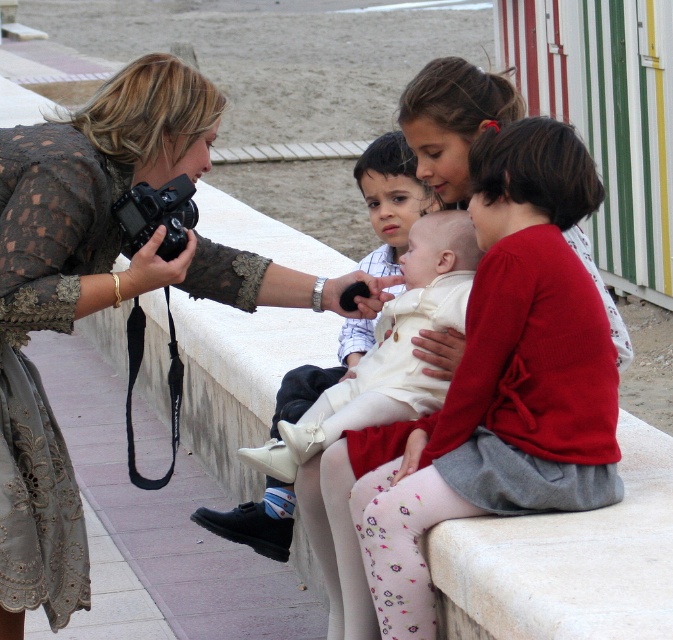
Question: Which point is closer to the camera?

Choices:
 (A) matte red sweater at center
 (B) matte lace dress at upper left
 (C) white matte shirt at center
 (D) black plastic camera at left

Answer: (B)

Question: Does matte red sweater at center appear on the right side of white matte shirt at center?

Choices:
 (A) no
 (B) yes

Answer: (B)

Question: Estimate the real-world distances between objects in this image. Which object is farther from the matte red sweater at center?

Choices:
 (A) white matte shirt at center
 (B) black plastic camera at left
 (C) matte lace dress at upper left
 (D) white cotton dress at center

Answer: (D)

Question: Which object appears farthest from the camera in this image?

Choices:
 (A) white cotton dress at center
 (B) black plastic camera at left

Answer: (A)

Question: Is matte lace dress at upper left to the left of white matte shirt at center from the viewer's perspective?

Choices:
 (A) no
 (B) yes

Answer: (B)

Question: Does matte lace dress at upper left appear under black plastic camera at left?

Choices:
 (A) no
 (B) yes

Answer: (B)